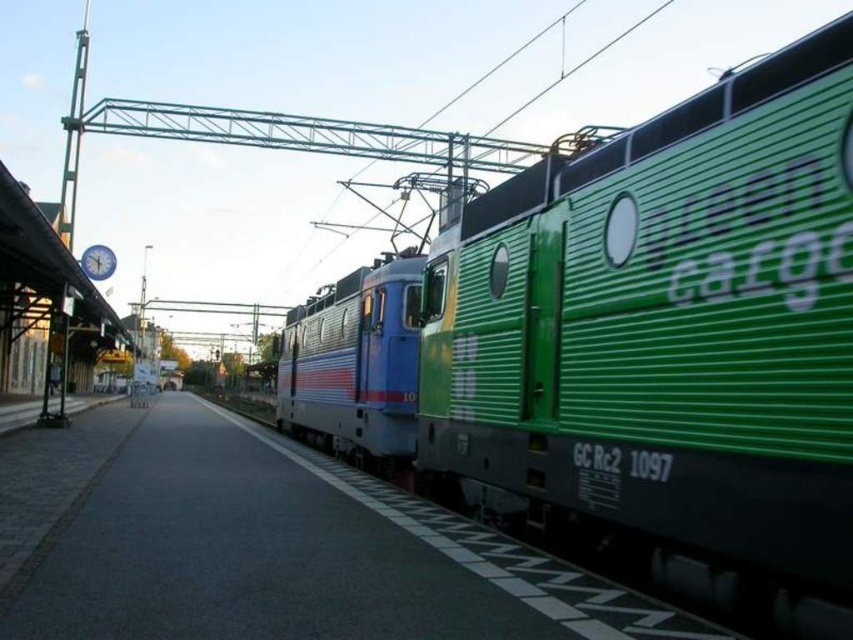
Consider the image. You are a railway engineer assessing the space between two trains. The green corrugated train at right and the metallic blue train car at center are parked parallel to each other. If the space between them is 2 meters, can a standard 1.8 meter wide maintenance cart pass through the gap?

The green corrugated train at right is wider than the metallic blue train car at center. Since the space between them is 2 meters, which is wider than the maintenance cart width of 1.8 meters, the cart can pass through the gap.